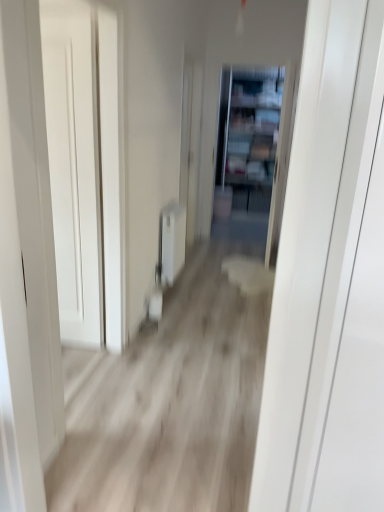
Question: Is clear glass bookshelf at center facing towards wooden floor at center?

Choices:
 (A) yes
 (B) no

Answer: (A)

Question: From the image's perspective, is clear glass bookshelf at center above wooden floor at center?

Choices:
 (A) no
 (B) yes

Answer: (B)

Question: Would you consider clear glass bookshelf at center to be distant from wooden floor at center?

Choices:
 (A) no
 (B) yes

Answer: (B)

Question: Is clear glass bookshelf at center shorter than wooden floor at center?

Choices:
 (A) yes
 (B) no

Answer: (B)

Question: Is clear glass bookshelf at center smaller than wooden floor at center?

Choices:
 (A) no
 (B) yes

Answer: (B)

Question: From the image's perspective, is clear glass bookshelf at center under wooden floor at center?

Choices:
 (A) no
 (B) yes

Answer: (A)

Question: Is white smooth door at left at the right side of clear glass bookshelf at center?

Choices:
 (A) no
 (B) yes

Answer: (A)

Question: Considering the relative sizes of white smooth door at left and clear glass bookshelf at center in the image provided, is white smooth door at left shorter than clear glass bookshelf at center?

Choices:
 (A) yes
 (B) no

Answer: (A)

Question: Is white smooth door at left positioned before clear glass bookshelf at center?

Choices:
 (A) yes
 (B) no

Answer: (A)

Question: Is clear glass bookshelf at center inside white smooth door at left?

Choices:
 (A) no
 (B) yes

Answer: (A)

Question: Is white smooth door at left oriented towards clear glass bookshelf at center?

Choices:
 (A) no
 (B) yes

Answer: (A)

Question: Is white smooth door at left further to the viewer compared to clear glass bookshelf at center?

Choices:
 (A) yes
 (B) no

Answer: (B)

Question: From a real-world perspective, is clear glass bookshelf at center on top of white smooth door at left?

Choices:
 (A) no
 (B) yes

Answer: (B)